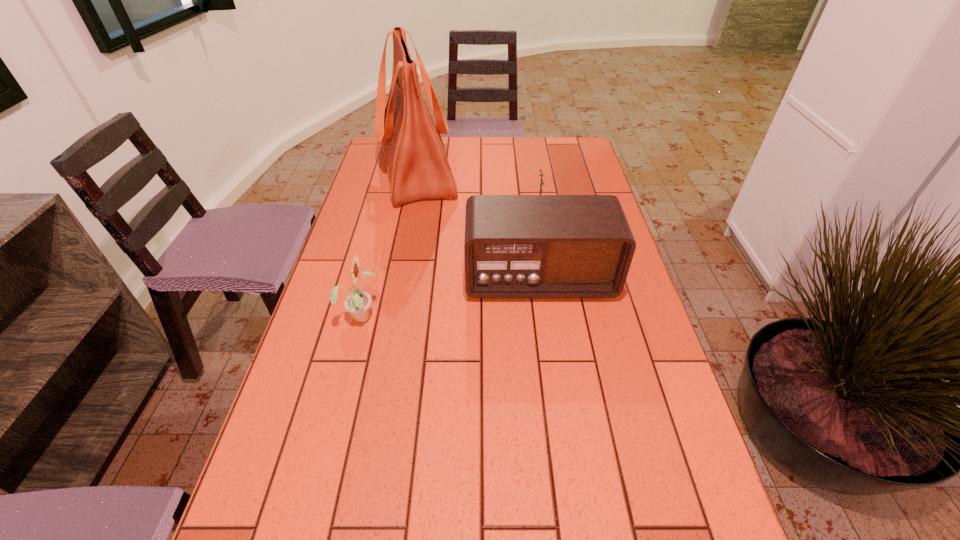
I want to click on shopping bag, so click(418, 168).

Where is `the farthest object`? the farthest object is located at coordinates (418, 168).

Where is `radio receiver`? This screenshot has width=960, height=540. radio receiver is located at coordinates (516, 246).

Where is `the left sunflower`? the left sunflower is located at coordinates click(358, 303).

Image resolution: width=960 pixels, height=540 pixels. I want to click on the right sunflower, so click(x=542, y=183).

Find the location of a particular element. Image resolution: width=960 pixels, height=540 pixels. the farther sunflower is located at coordinates (542, 183).

Locate an element on the screen. Image resolution: width=960 pixels, height=540 pixels. vacant region located on the right of the shopping bag is located at coordinates (544, 171).

In order to click on free region located on the front-facing side of the radio receiver in this screenshot , I will do `click(546, 330)`.

Locate an element on the screen. The width and height of the screenshot is (960, 540). free space located 0.400m on the front-facing side of the left sunflower is located at coordinates (542, 315).

Locate an element on the screen. Image resolution: width=960 pixels, height=540 pixels. free point located 0.300m on the face of the farther sunflower is located at coordinates (432, 217).